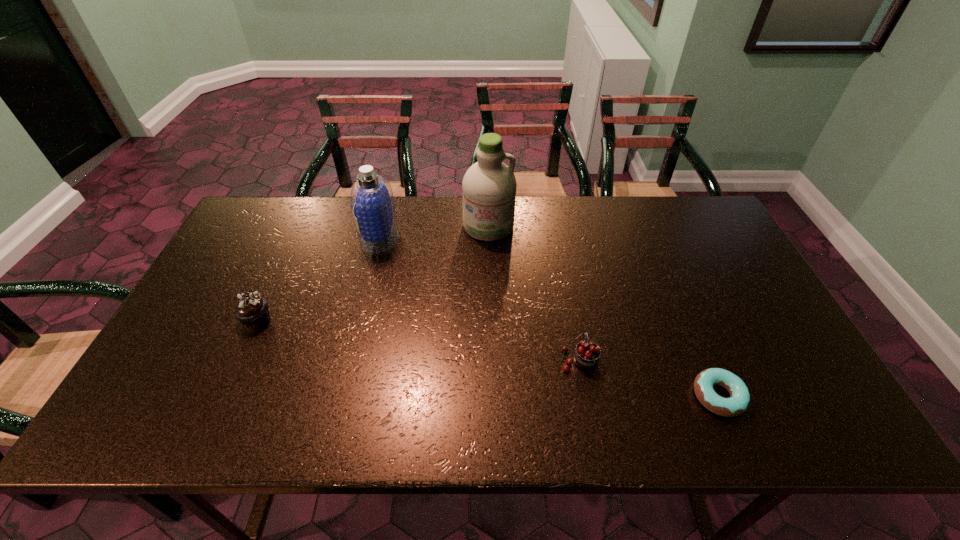
Identify the location of vacant area at the near edge. This screenshot has width=960, height=540. (540, 436).

Where is `free space at the left edge`? This screenshot has width=960, height=540. free space at the left edge is located at coordinates (234, 280).

In the image, there is a desktop. At what (x,y) coordinates should I click in order to perform the action: click on vacant space at the right edge. Please return your answer as a coordinate pair (x, y). This screenshot has height=540, width=960. Looking at the image, I should click on (x=772, y=335).

The image size is (960, 540). In the image, there is a desktop. What are the coordinates of `vacant area at the far left corner` in the screenshot? It's located at (241, 230).

The width and height of the screenshot is (960, 540). I want to click on free location at the near left corner, so click(123, 431).

In the image, there is a desktop. Identify the location of vacant region at the far right corner. The width and height of the screenshot is (960, 540). (714, 218).

Locate an element on the screen. free space between the doughnut and the second object from right to left is located at coordinates (649, 377).

Locate an element on the screen. The height and width of the screenshot is (540, 960). unoccupied area between the third nearest object and the cherry is located at coordinates (418, 339).

Identify the location of free spot between the nearest object and the tallest object. (603, 311).

Locate an element on the screen. The width and height of the screenshot is (960, 540). free spot between the third nearest object and the taller cleansing agent is located at coordinates (372, 273).